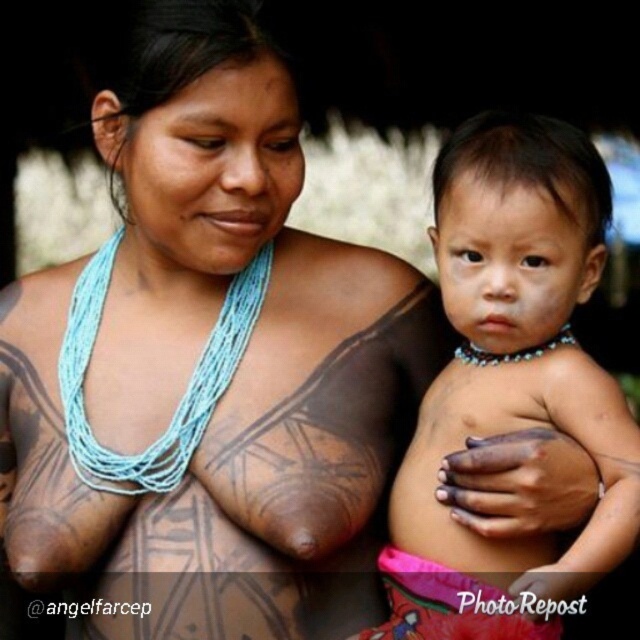
Who is more distant from viewer, (241, 308) or (132, 246)?

The point (132, 246) is behind.

Is blue string necklace at upper center thinner than blue beaded necklace at upper center?

In fact, blue string necklace at upper center might be wider than blue beaded necklace at upper center.

The width and height of the screenshot is (640, 640). In order to click on blue string necklace at upper center in this screenshot , I will do `click(182, 396)`.

At what (x,y) coordinates should I click in order to perform the action: click on blue string necklace at upper center. Please return your answer as a coordinate pair (x, y). Image resolution: width=640 pixels, height=640 pixels. Looking at the image, I should click on [182, 396].

Is brown skin tattoo at upper center below matte skin baby at center?

No, brown skin tattoo at upper center is not below matte skin baby at center.

Does brown skin tattoo at upper center appear on the left side of matte skin baby at center?

Indeed, brown skin tattoo at upper center is positioned on the left side of matte skin baby at center.

Identify the location of brown skin tattoo at upper center. The width and height of the screenshot is (640, 640). (205, 339).

Is point (544, 588) closer to camera compared to point (134, 266)?

Yes, point (544, 588) is closer to viewer.

Who is more distant from viewer, (596,225) or (218,296)?

Point (218,296)

Is point (589, 582) positioned before point (204, 280)?

Yes, it is in front of point (204, 280).

Locate an element on the screen. Image resolution: width=640 pixels, height=640 pixels. matte skin baby at center is located at coordinates (509, 380).